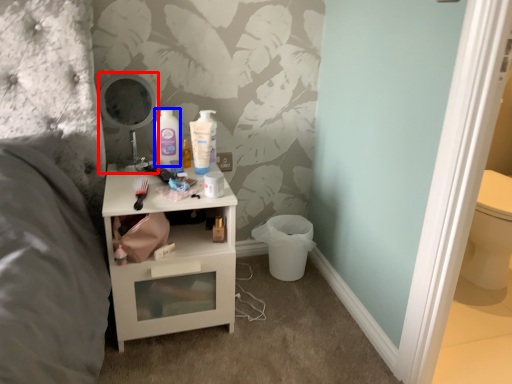
Question: Which object is closer to the camera taking this photo, mirror (highlighted by a red box) or mouthwash (highlighted by a blue box)?

Choices:
 (A) mirror
 (B) mouthwash

Answer: (A)